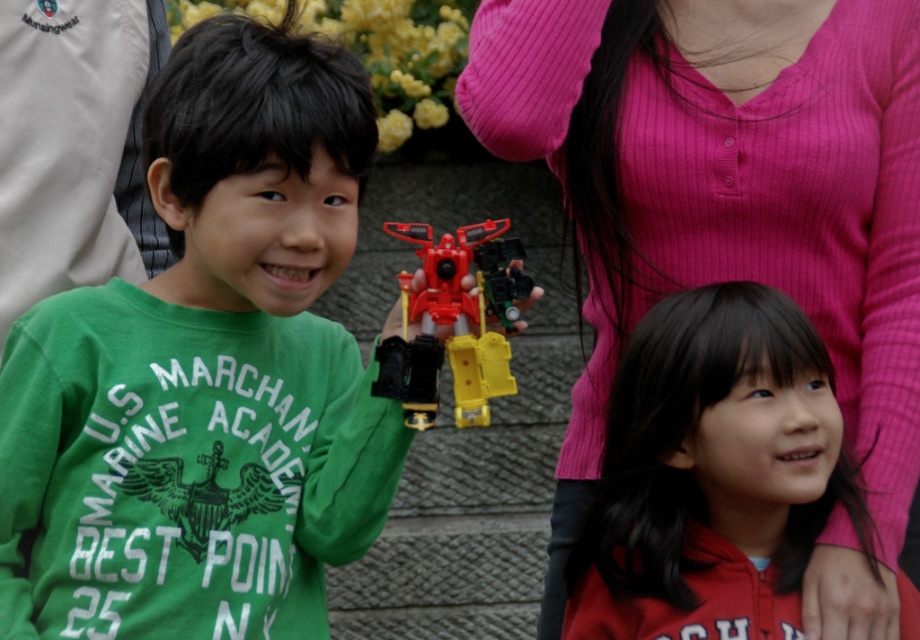
You are a photographer trying to capture a photo of the matte plastic robot at center and the matte red hoodie at center. Since you want to focus on the robot, which object should you adjust your camera to focus on first?

The matte red hoodie at center is positioned under the matte plastic robot at center, so you should focus on the matte plastic robot at center first as it is higher up.